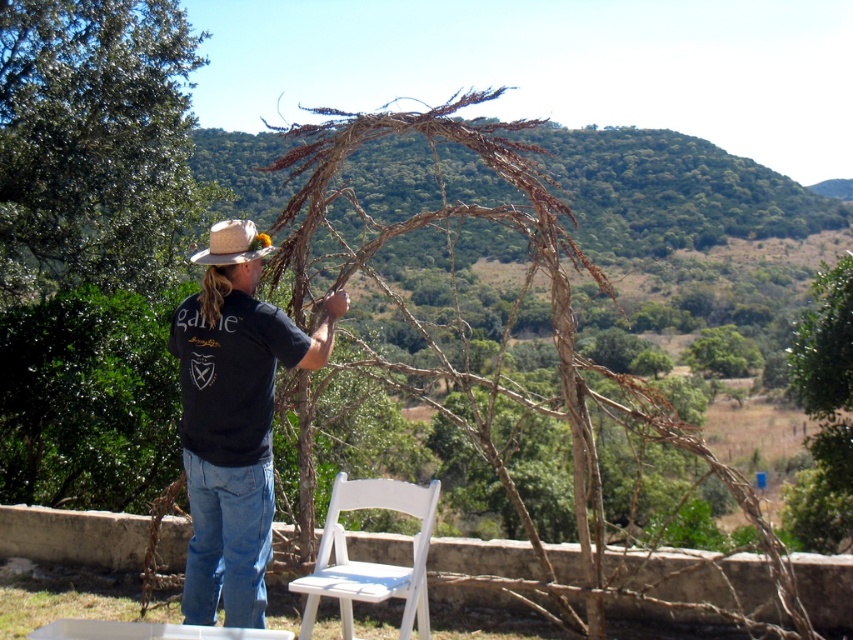
Can you confirm if dry wood branch at center is positioned to the right of natural straw cowboy hat at left?

Yes, dry wood branch at center is to the right of natural straw cowboy hat at left.

Is dry wood branch at center further to camera compared to natural straw cowboy hat at left?

No, it is not.

Where is `dry wood branch at center`? This screenshot has height=640, width=853. dry wood branch at center is located at coordinates (498, 358).

How far apart are white wood chair at lower center and natural straw cowboy hat at left?

white wood chair at lower center is 2.01 meters from natural straw cowboy hat at left.

Locate an element on the screen. white wood chair at lower center is located at coordinates (367, 561).

Can you confirm if dry wood branch at center is positioned above white wood chair at lower center?

Yes.

Is dry wood branch at center taller than white wood chair at lower center?

Yes.

Describe the element at coordinates (498, 358) in the screenshot. This screenshot has width=853, height=640. I see `dry wood branch at center` at that location.

Where is `dry wood branch at center`? dry wood branch at center is located at coordinates (498, 358).